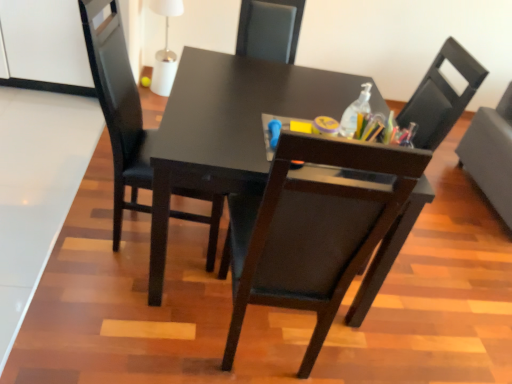
Identify the location of vacant space that is to the left of clear plastic bottle at upper right. (298, 109).